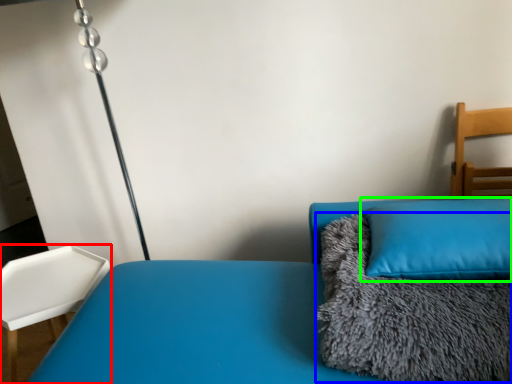
Question: Which object is the farthest from furniture (highlighted by a red box)? Choose among these: blanket (highlighted by a blue box) or pillow (highlighted by a green box).

Choices:
 (A) blanket
 (B) pillow

Answer: (B)